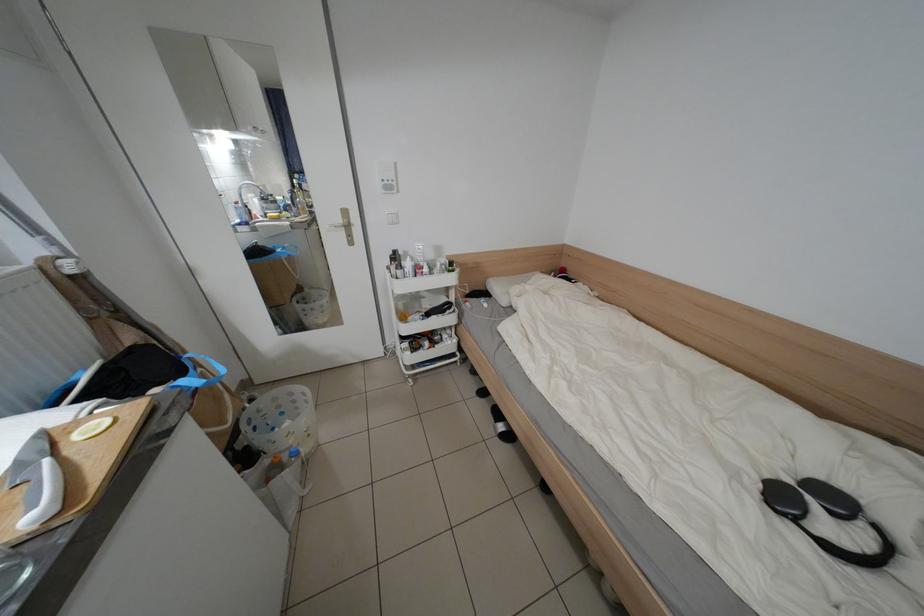
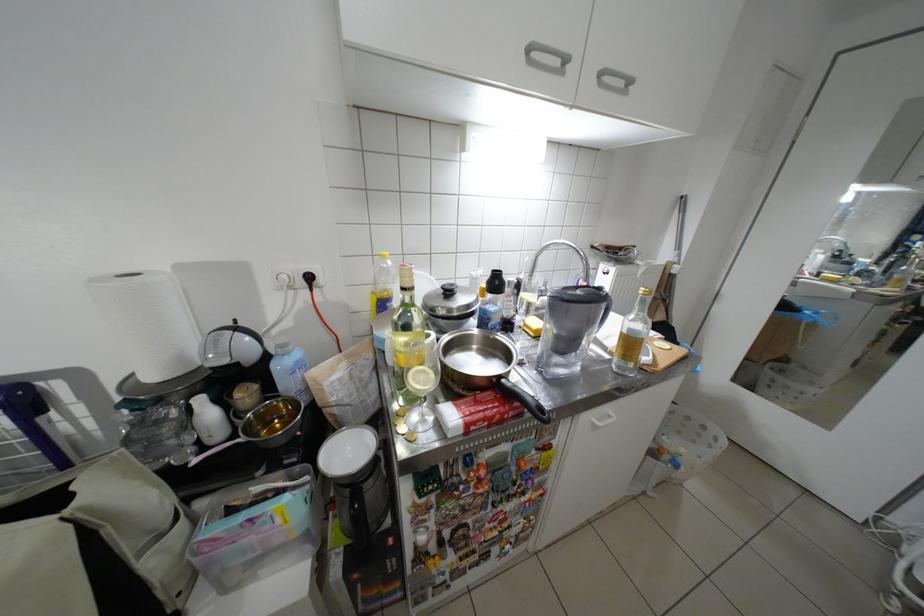
Where in the second image is the point corresponding to point 67,511 from the first image?

(662, 363)